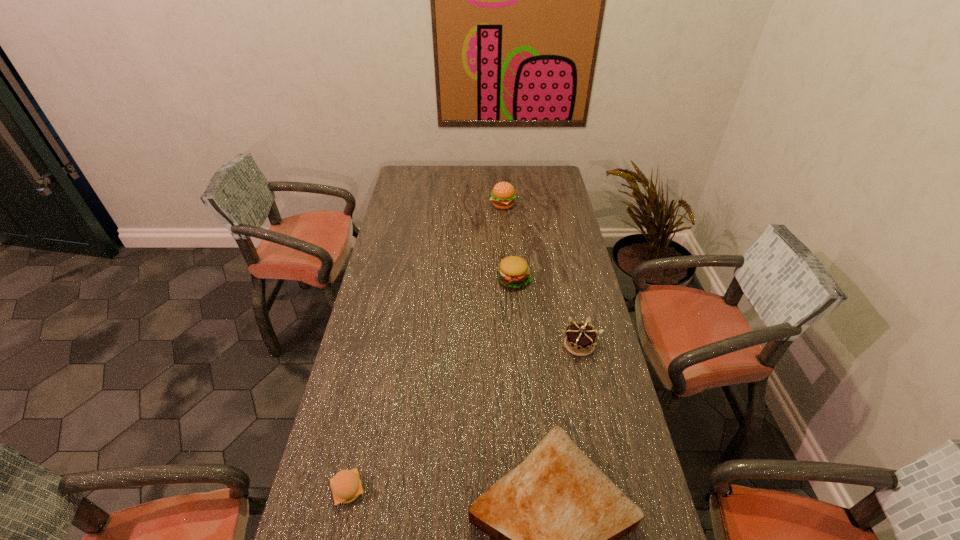
Identify the location of unoccupied area between the second nearest hamburger and the leftmost hamburger. The image size is (960, 540). (431, 385).

At what (x,y) coordinates should I click in order to perform the action: click on free space between the shortest hamburger and the crown. Please return your answer as a coordinate pair (x, y). The image size is (960, 540). Looking at the image, I should click on (464, 417).

At what (x,y) coordinates should I click in order to perform the action: click on object that ranks as the closest to the third farthest object. Please return your answer as a coordinate pair (x, y). Image resolution: width=960 pixels, height=540 pixels. Looking at the image, I should click on (513, 272).

Locate an element on the screen. the closest object to the leftmost hamburger is located at coordinates (556, 518).

This screenshot has width=960, height=540. Identify the location of hamburger object that ranks as the second closest to the bread. (513, 272).

This screenshot has height=540, width=960. In order to click on hamburger identified as the second closest to the farthest object in this screenshot , I will do (346, 486).

This screenshot has height=540, width=960. Identify the location of vacant region that satisfies the following two spatial constraints: 1. on the back side of the leftmost object; 2. on the left side of the farthest object. (410, 205).

Find the location of `free space that satisfies the following two spatial constraints: 1. on the front side of the tallest object; 2. on the right side of the second tallest hamburger`. free space that satisfies the following two spatial constraints: 1. on the front side of the tallest object; 2. on the right side of the second tallest hamburger is located at coordinates (508, 280).

Where is `blank space that satisfies the following two spatial constraints: 1. on the back side of the shortest hamburger; 2. on the right side of the tallest object`? The width and height of the screenshot is (960, 540). blank space that satisfies the following two spatial constraints: 1. on the back side of the shortest hamburger; 2. on the right side of the tallest object is located at coordinates (410, 205).